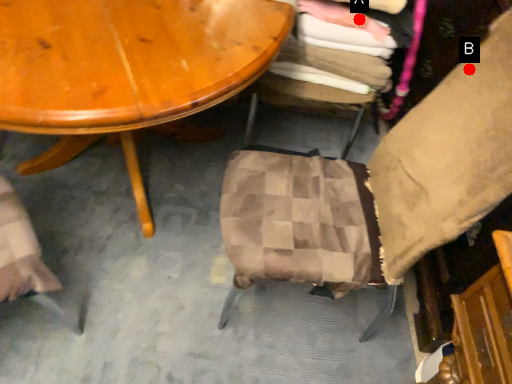
Question: Two points are circled on the image, labeled by A and B beside each circle. Which point is farther from the camera taking this photo?

Choices:
 (A) A is further
 (B) B is further

Answer: (A)